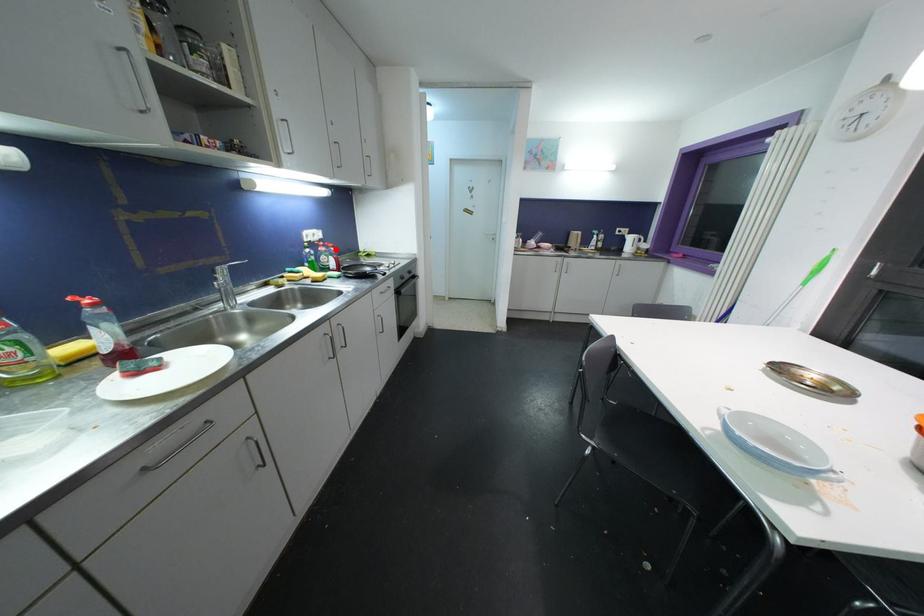
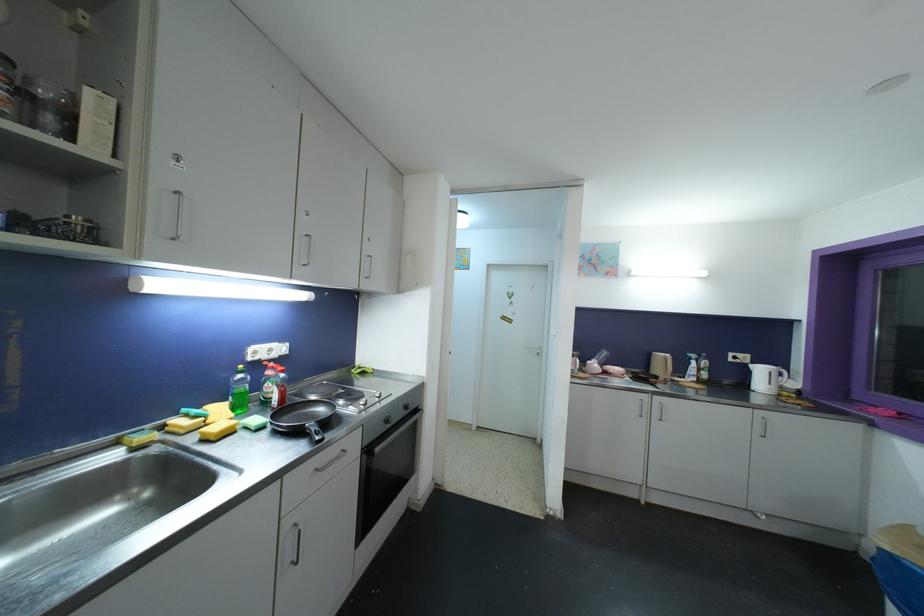
Find the pixel in the second image that matches the highlighted location in the first image.

(286, 374)